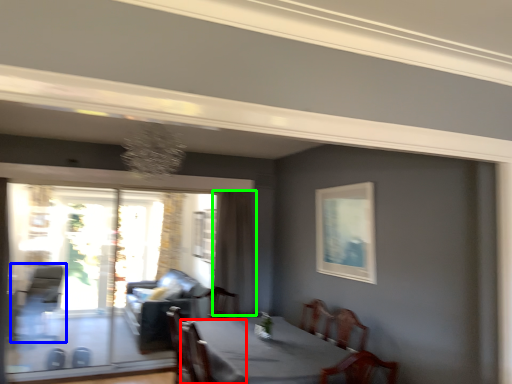
Question: Based on their relative distances, which object is farther from armchair (highlighted by a red box)? Choose from armchair (highlighted by a blue box) and curtain (highlighted by a green box).

Choices:
 (A) armchair
 (B) curtain

Answer: (A)